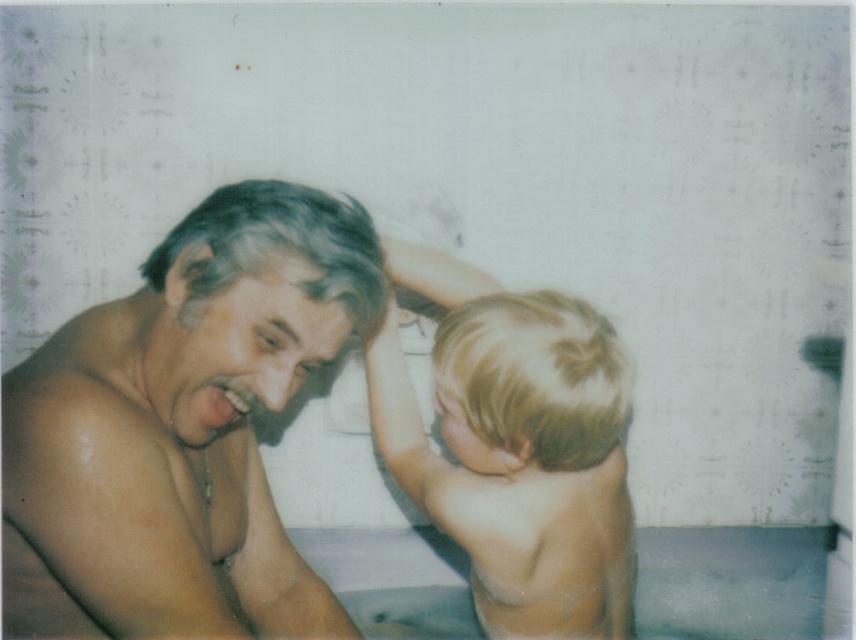
Is point (580, 524) closer to viewer compared to point (669, 550)?

Yes, point (580, 524) is closer to viewer.

Identify the location of blonde hair at upper right. (507, 452).

Which is in front, point (143, 541) or point (569, 408)?

Point (143, 541) is in front.

Between smooth skin man at center and blonde hair at upper right, which one is positioned lower?

smooth skin man at center is lower down.

Describe the element at coordinates (181, 428) in the screenshot. I see `smooth skin man at center` at that location.

This screenshot has width=856, height=640. Identify the location of smooth skin man at center. (181, 428).

Is smooth skin man at center closer to the viewer compared to white smooth foam at lower center?

Yes, smooth skin man at center is closer to the viewer.

Is smooth skin man at center to the left of white smooth foam at lower center from the viewer's perspective?

Yes, smooth skin man at center is to the left of white smooth foam at lower center.

This screenshot has height=640, width=856. Describe the element at coordinates (181, 428) in the screenshot. I see `smooth skin man at center` at that location.

Find the location of a particular element. This screenshot has width=856, height=640. smooth skin man at center is located at coordinates (x=181, y=428).